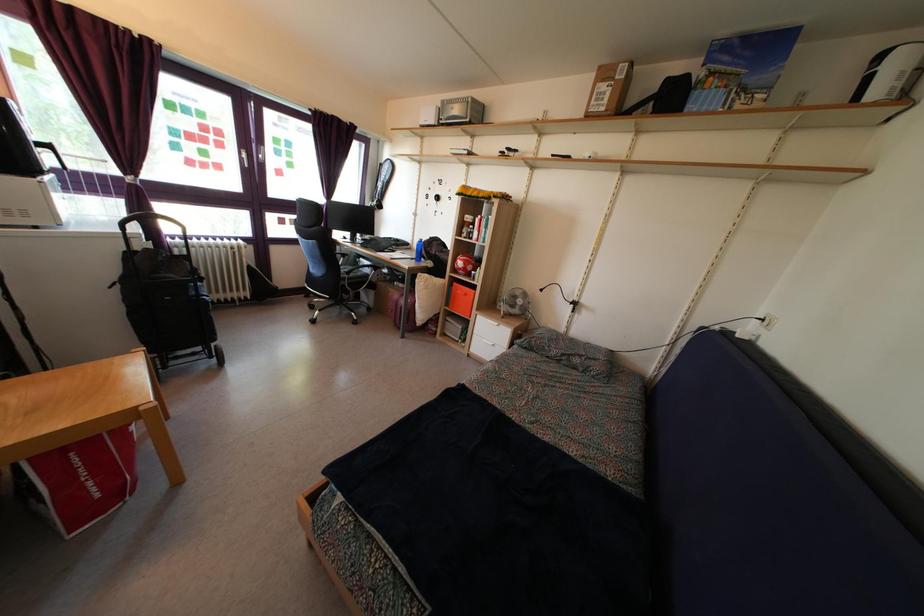
Where is `cardboard box`? cardboard box is located at coordinates (609, 89).